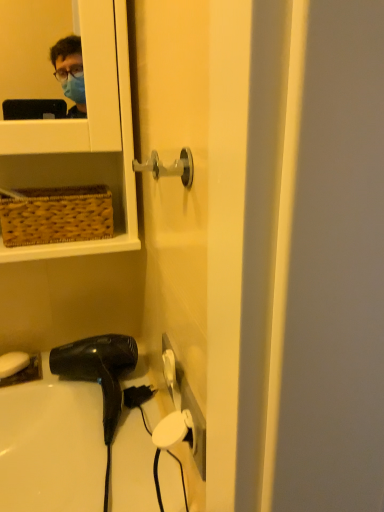
The image size is (384, 512). In order to click on white matte soap at lower left in this screenshot , I will do `click(13, 362)`.

The image size is (384, 512). Describe the element at coordinates (13, 362) in the screenshot. I see `white matte soap at lower left` at that location.

What are the coordinates of `black matte hair dryer at lower left` in the screenshot? It's located at (99, 370).

What is the approximate width of black matte hair dryer at lower left?

The width of black matte hair dryer at lower left is 24.25 centimeters.

The image size is (384, 512). What do you see at coordinates (99, 370) in the screenshot?
I see `black matte hair dryer at lower left` at bounding box center [99, 370].

Where is `white matte soap at lower left`? white matte soap at lower left is located at coordinates (13, 362).

Is black matte hair dryer at lower left to the left of white matte soap at lower left from the viewer's perspective?

No, black matte hair dryer at lower left is not to the left of white matte soap at lower left.

Is black matte hair dryer at lower left in front of white matte soap at lower left?

Yes, black matte hair dryer at lower left is closer to the viewer.

Considering the points (92, 338) and (22, 356), which point is in front, point (92, 338) or point (22, 356)?

The point (92, 338) is closer.

Based on the photo, from the image's perspective, is black matte hair dryer at lower left located above or below white matte soap at lower left?

From the image's perspective, black matte hair dryer at lower left appears below white matte soap at lower left.

Looking at this image, from a real-world perspective, which is physically above, black matte hair dryer at lower left or white matte soap at lower left?

black matte hair dryer at lower left is physically above.

Looking at their sizes, would you say black matte hair dryer at lower left is wider or thinner than white matte soap at lower left?

Considering their sizes, black matte hair dryer at lower left looks broader than white matte soap at lower left.

In terms of height, does black matte hair dryer at lower left look taller or shorter compared to white matte soap at lower left?

In the image, black matte hair dryer at lower left appears to be taller than white matte soap at lower left.

Does black matte hair dryer at lower left have a larger size compared to white matte soap at lower left?

Yes, black matte hair dryer at lower left is bigger than white matte soap at lower left.

Is white matte soap at lower left located within black matte hair dryer at lower left?

No, white matte soap at lower left is located outside of black matte hair dryer at lower left.

Is black matte hair dryer at lower left beside white matte soap at lower left?

No, black matte hair dryer at lower left is not touching white matte soap at lower left.

Is black matte hair dryer at lower left oriented towards white matte soap at lower left?

No, black matte hair dryer at lower left is not facing towards white matte soap at lower left.

Consider the image. Can you tell me how much black matte hair dryer at lower left and white matte soap at lower left differ in facing direction?

black matte hair dryer at lower left and white matte soap at lower left are facing 15.5 degrees away from each other.

Identify the location of soap that is on the left side of black matte hair dryer at lower left. (13, 362).

Considering the positions of objects white matte soap at lower left and black matte hair dryer at lower left in the image provided, who is more to the left, white matte soap at lower left or black matte hair dryer at lower left?

white matte soap at lower left.

Who is more distant, white matte soap at lower left or black matte hair dryer at lower left?

white matte soap at lower left is behind.

Between point (17, 351) and point (120, 407), which one is positioned behind?

Positioned behind is point (17, 351).

From the image's perspective, between white matte soap at lower left and black matte hair dryer at lower left, which one is located above?

white matte soap at lower left.

From a real-world perspective, which object rests below the other?

white matte soap at lower left.

Which object is thinner, white matte soap at lower left or black matte hair dryer at lower left?

With smaller width is white matte soap at lower left.

Considering the relative sizes of white matte soap at lower left and black matte hair dryer at lower left in the image provided, is white matte soap at lower left shorter than black matte hair dryer at lower left?

Correct, white matte soap at lower left is not as tall as black matte hair dryer at lower left.

Is white matte soap at lower left bigger than black matte hair dryer at lower left?

Actually, white matte soap at lower left might be smaller than black matte hair dryer at lower left.

Is white matte soap at lower left not within black matte hair dryer at lower left?

white matte soap at lower left is positioned outside black matte hair dryer at lower left.

Would you consider white matte soap at lower left to be distant from black matte hair dryer at lower left?

white matte soap at lower left is near black matte hair dryer at lower left, not far away.

Could you tell me if white matte soap at lower left is facing black matte hair dryer at lower left?

No.

Can you tell me how much white matte soap at lower left and black matte hair dryer at lower left differ in facing direction?

There is a 15.5-degree angle between the facing directions of white matte soap at lower left and black matte hair dryer at lower left.

Measure the distance from white matte soap at lower left to black matte hair dryer at lower left.

The distance of white matte soap at lower left from black matte hair dryer at lower left is 6.67 inches.

Identify the location of soap behind the black matte hair dryer at lower left. Image resolution: width=384 pixels, height=512 pixels. (13, 362).

Where is `soap to the left of black matte hair dryer at lower left`? soap to the left of black matte hair dryer at lower left is located at coordinates (13, 362).

Where is `soap behind the black matte hair dryer at lower left`? soap behind the black matte hair dryer at lower left is located at coordinates (13, 362).